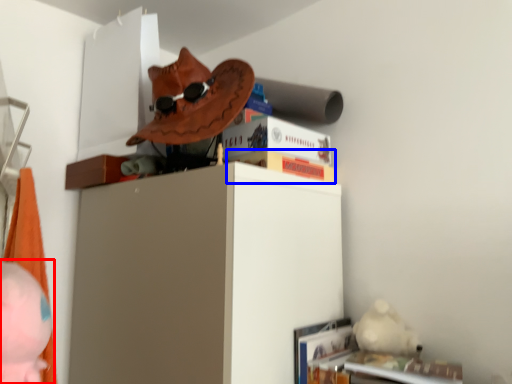
Question: Which of the following is the farthest to the observer, person (highlighted by a red box) or paperback book (highlighted by a blue box)?

Choices:
 (A) person
 (B) paperback book

Answer: (B)